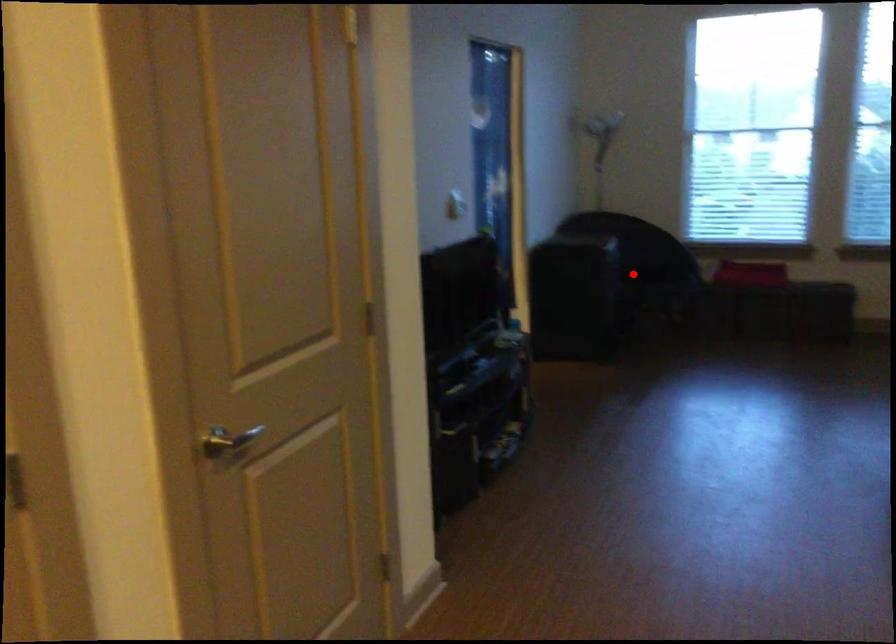
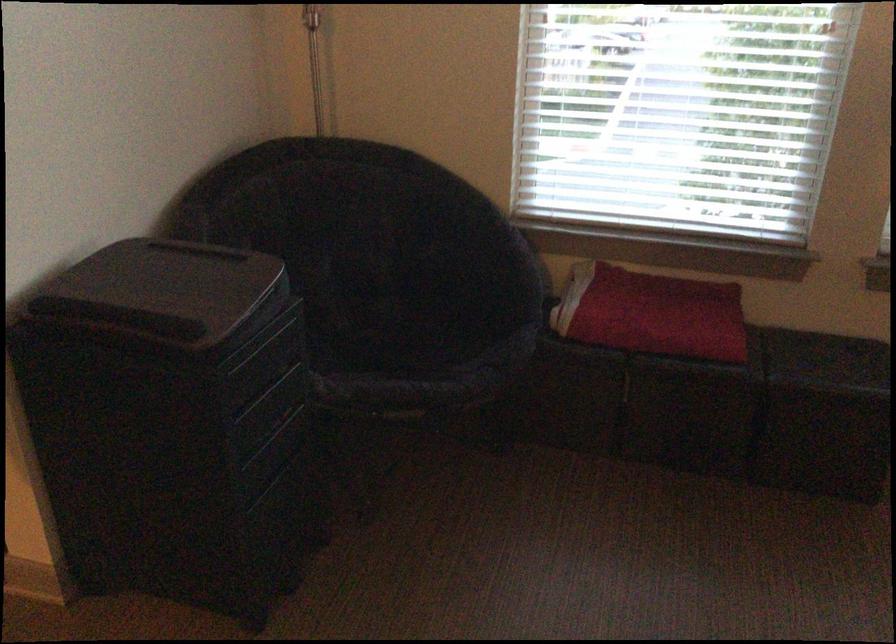
In the second image, find the point that corresponds to the highlighted location in the first image.

(393, 339)